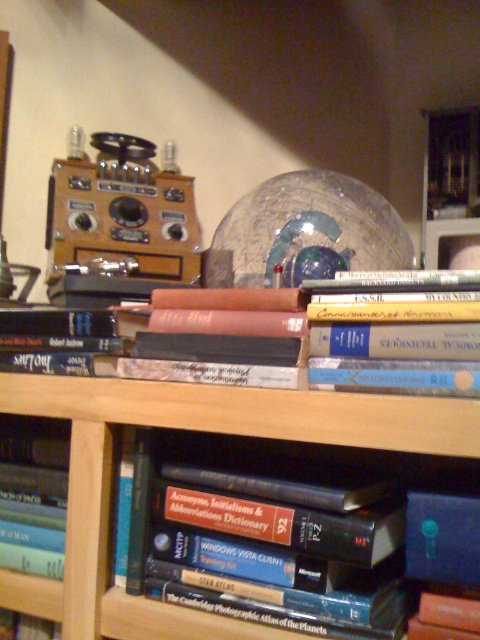
How much distance is there between hardcover books at center and blue hardcover book at lower left?

hardcover books at center and blue hardcover book at lower left are 6.09 inches apart from each other.

Looking at this image, can you confirm if hardcover books at center is positioned above blue hardcover book at lower left?

Indeed, hardcover books at center is positioned over blue hardcover book at lower left.

Is point (97, 512) farther from viewer compared to point (22, 429)?

No, it is not.

This screenshot has height=640, width=480. Identify the location of hardcover books at center. (195, 429).

Between point (52, 368) and point (48, 524), which one is positioned behind?

Point (48, 524)

Can you confirm if hardcover book at center is taller than blue hardcover book at lower left?

In fact, hardcover book at center may be shorter than blue hardcover book at lower left.

Is point (312, 381) behind point (49, 525)?

No, (312, 381) is in front of (49, 525).

This screenshot has height=640, width=480. What are the coordinates of `hardcover book at center` in the screenshot? It's located at (288, 339).

Is hardcover book at center positioned at the back of hardcover books at center?

Yes, it is behind hardcover books at center.

Does hardcover book at center have a larger size compared to hardcover books at center?

Actually, hardcover book at center might be smaller than hardcover books at center.

Is point (1, 364) positioned after point (380, 422)?

That is True.

Locate an element on the screen. hardcover book at center is located at coordinates (288, 339).